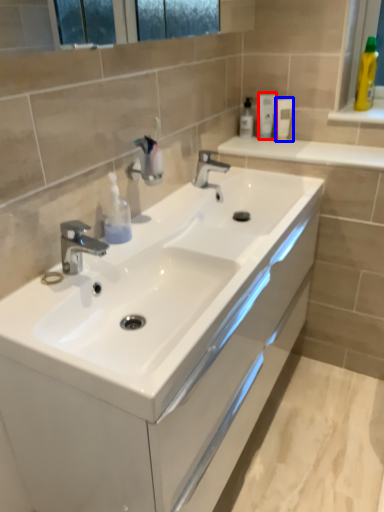
Question: Among these objects, which one is farthest to the camera, mouthwash (highlighted by a red box) or mouthwash (highlighted by a blue box)?

Choices:
 (A) mouthwash
 (B) mouthwash

Answer: (A)